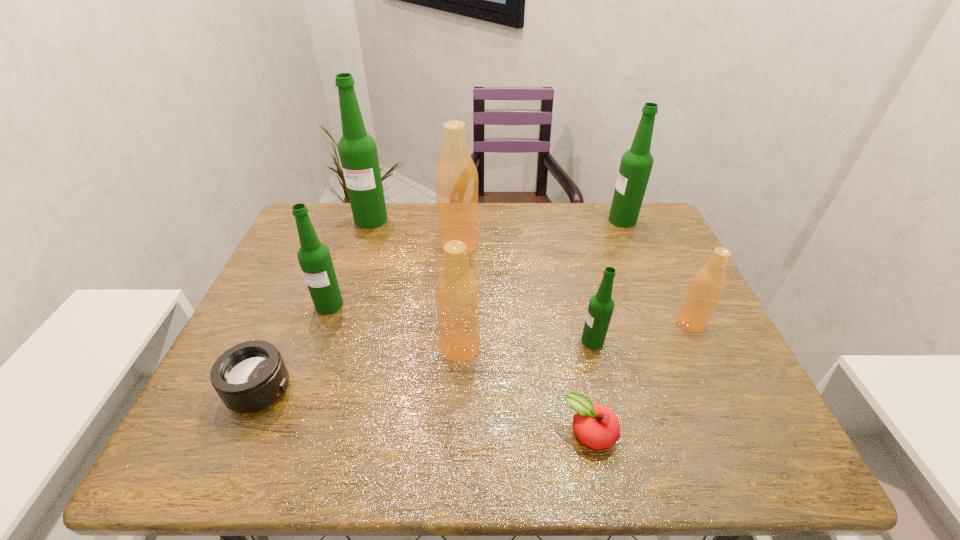
Where is `vacant region located 0.160m on the label of the nearest green beer bottle`? The height and width of the screenshot is (540, 960). vacant region located 0.160m on the label of the nearest green beer bottle is located at coordinates (515, 341).

Where is `free space located 0.070m on the label of the nearest green beer bottle`? Image resolution: width=960 pixels, height=540 pixels. free space located 0.070m on the label of the nearest green beer bottle is located at coordinates (552, 341).

I want to click on free space located 0.200m on the front of the smallest tan beer bottle, so click(x=731, y=406).

Where is `free region located on the side of the telephoto lens with brand markings and control switches`? free region located on the side of the telephoto lens with brand markings and control switches is located at coordinates (408, 390).

Identify the location of vacant space located 0.060m on the back of the red apple. (581, 388).

Find the location of a particular element. object situated at the near edge is located at coordinates (596, 426).

Where is `beer bottle located in the left edge section of the desktop`? The image size is (960, 540). beer bottle located in the left edge section of the desktop is located at coordinates (314, 257).

Locate an element on the screen. The height and width of the screenshot is (540, 960). telephoto lens positioned at the left edge is located at coordinates (249, 377).

Identify the location of object that is at the far right corner. (636, 164).

In the image, there is a desktop. Where is `blank space at the far edge`? This screenshot has width=960, height=540. blank space at the far edge is located at coordinates (590, 232).